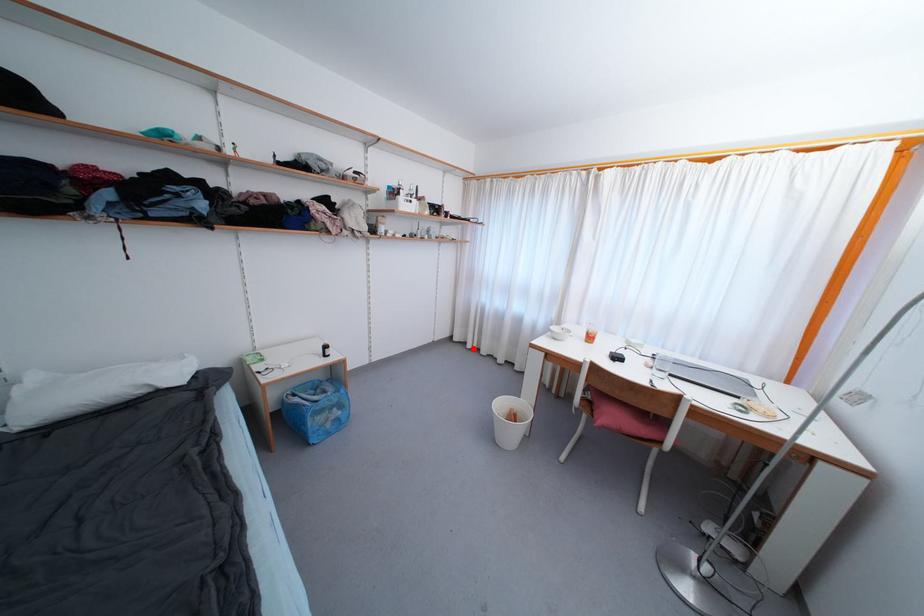
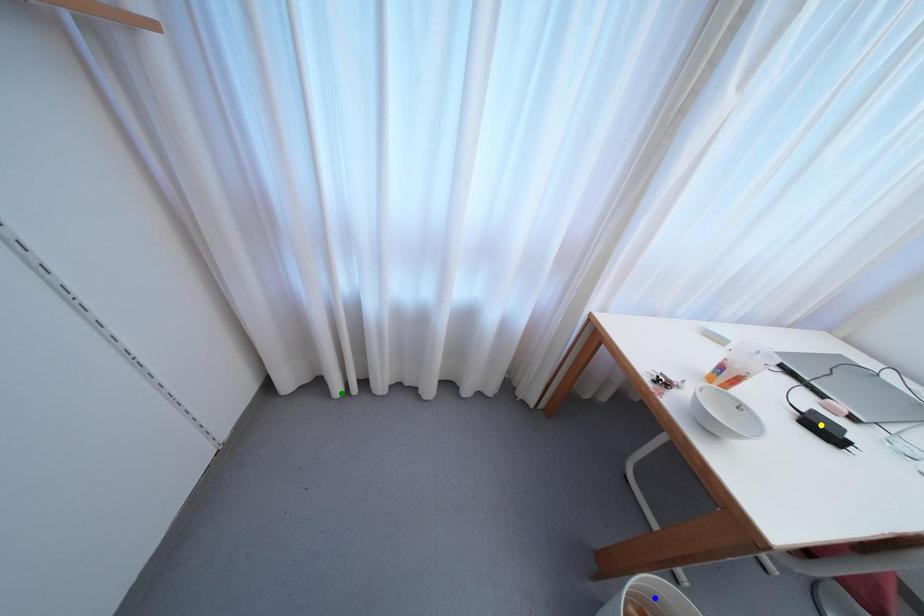
Question: I am providing you with two images of the same scene from different viewpoints. A red point is marked on the first image. You are given multiple points on the second image. Which point in image 2 represents the same 3d spot as the red point in image 1?

Choices:
 (A) green point
 (B) yellow point
 (C) blue point

Answer: (A)